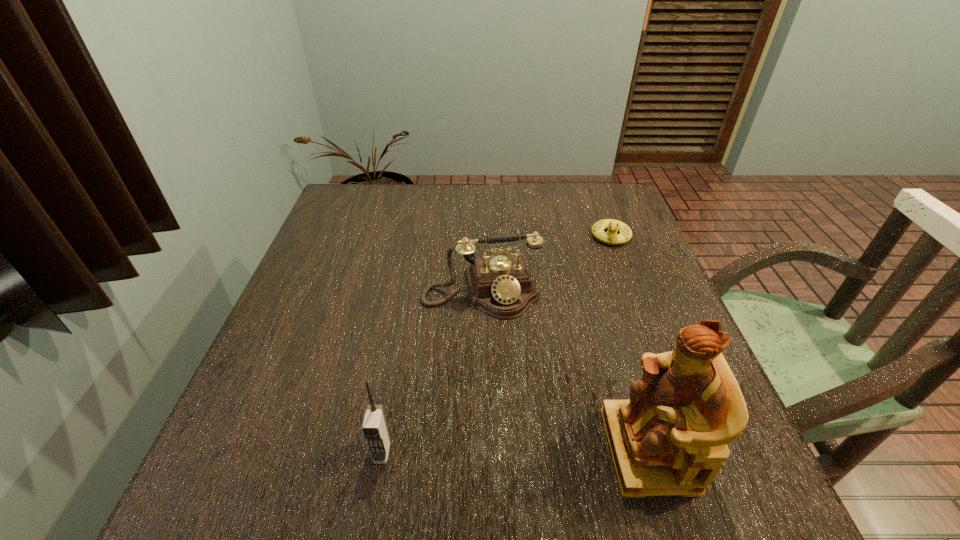
Locate an element on the screen. the leftmost object is located at coordinates (375, 430).

Find the location of a particular element. This screenshot has height=540, width=960. figurine is located at coordinates (670, 438).

Where is `the shortest object`? The image size is (960, 540). the shortest object is located at coordinates (611, 237).

Find the location of a particular element. Image resolution: width=960 pixels, height=540 pixels. duckling is located at coordinates (611, 237).

Locate an element on the screen. Image resolution: width=960 pixels, height=540 pixels. telephone is located at coordinates (500, 286).

At what (x,y) coordinates should I click in order to perform the action: click on the third nearest object. Please return your answer as a coordinate pair (x, y). This screenshot has width=960, height=540. Looking at the image, I should click on (500, 286).

Identify the location of vacant space located 0.270m on the front-facing side of the figurine. This screenshot has width=960, height=540. (452, 450).

This screenshot has width=960, height=540. What are the coordinates of `free space located on the front-facing side of the figurine` in the screenshot? It's located at (492, 450).

Locate an element on the screen. This screenshot has height=540, width=960. blank space located 0.170m on the front-facing side of the figurine is located at coordinates (511, 450).

At what (x,y) coordinates should I click in order to perform the action: click on vacant space located 0.210m on the face of the farthest object. Please return your answer as a coordinate pair (x, y). This screenshot has height=540, width=960. Looking at the image, I should click on (594, 298).